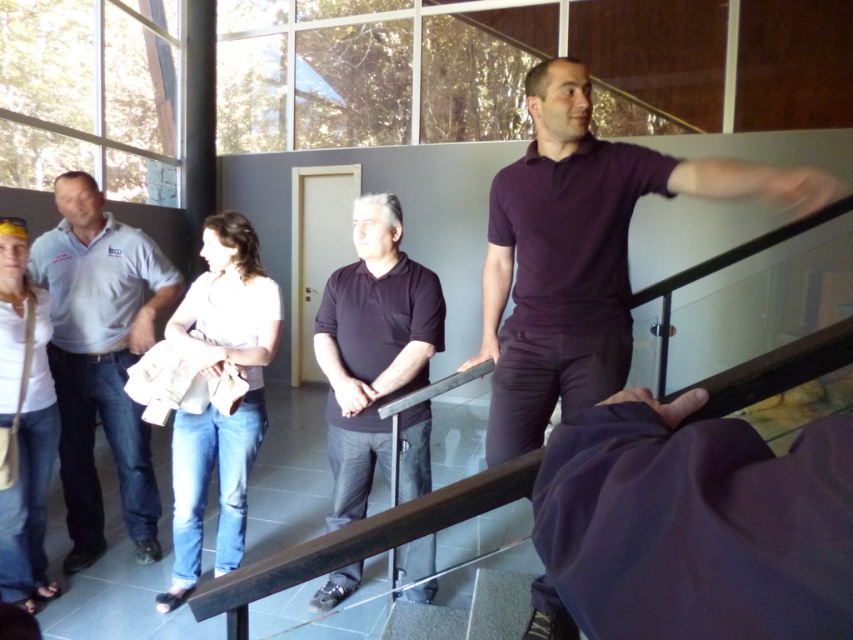
You are standing at the viewer position in the scene. There is a point at coordinates (384, 436). Can you reach this point without moving your feet?

The distance between the viewer and the point at coordinates (384, 436) is 2.45 meters, so you cannot reach it without moving your feet since it is too far away.

You are one of the attendees at this event and want to take a photo of the light pink fabric shirt at center without including the light blue denim jeans at left in the frame. Is this possible given their positions?

The light pink fabric shirt at center is behind the light blue denim jeans at left, so if you position yourself to frame the light pink fabric shirt at center while avoiding the foreground obstruction of the light blue denim jeans at left, it should be possible to capture a photo without including them.

You are a photographer trying to capture a group photo of the dark matte polo shirt at center and the white matte shirt at lower left. To ensure both are in frame, which direction should you move the camera? Explain your reasoning based on their positions.

The dark matte polo shirt at center is to the right of the white matte shirt at lower left. To include both in the frame, you should move the camera to the left so that the white matte shirt at lower left comes into view while keeping the dark matte polo shirt at center in sight.